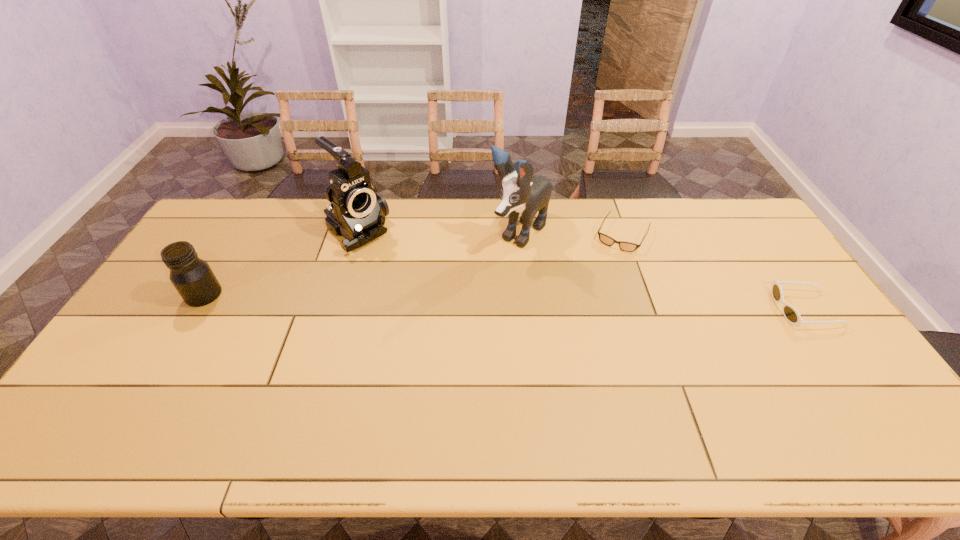
You are a GUI agent. You are given a task and a screenshot of the screen. Output one action in this format:
    pyautogui.click(x=<x>, y=<y>)
    Task: Click on the free point between the second shortest object and the second tallest object
    The width and height of the screenshot is (960, 540).
    Given the screenshot: What is the action you would take?
    pyautogui.click(x=582, y=271)

At what (x,y) coordinates should I click in order to perform the action: click on blank region between the shortest object and the fourth tallest object. Please return your answer as a coordinate pair (x, y). Image resolution: width=960 pixels, height=540 pixels. Looking at the image, I should click on (714, 272).

What are the coordinates of `empty space that is in between the third object from right to left and the second tallest object` in the screenshot? It's located at (439, 233).

Locate an element on the screen. This screenshot has width=960, height=540. vacant area between the right sunglasses and the shortest object is located at coordinates (714, 272).

Choose which object is the third nearest neighbor to the nearer sunglasses. Please provide its 2D coordinates. Your answer should be formatted as a tuple, i.e. [(x, y)], where the tuple contains the x and y coordinates of a point satisfying the conditions above.

[(357, 212)]

The image size is (960, 540). What are the coordinates of `object that is the second closest one to the shortest object` in the screenshot? It's located at (790, 313).

At what (x,y) coordinates should I click in order to perform the action: click on vacant position in the image that satisfies the following two spatial constraints: 1. on the front side of the fourth object from right to left; 2. with the lenses of the rightmost object facing outward. Please return your answer as a coordinate pair (x, y). The width and height of the screenshot is (960, 540). Looking at the image, I should click on (334, 309).